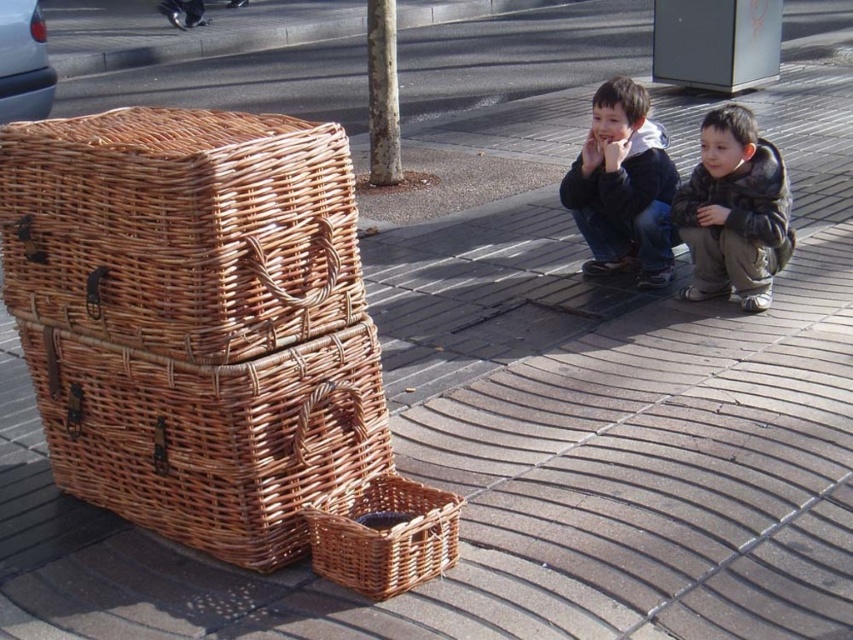
Does woven brown basket at left have a greater width compared to asphalt at upper center?

No, woven brown basket at left is not wider than asphalt at upper center.

Who is positioned more to the right, woven brown basket at left or asphalt at upper center?

From the viewer's perspective, woven brown basket at left appears more on the right side.

Identify the location of woven brown basket at left. (210, 435).

Is woven brown basket at lower left to the right of dark blue jacket at lower right from the viewer's perspective?

No, woven brown basket at lower left is not to the right of dark blue jacket at lower right.

Can you confirm if woven brown basket at lower left is positioned above dark blue jacket at lower right?

Actually, woven brown basket at lower left is below dark blue jacket at lower right.

Is point (109, 259) in front of point (631, 109)?

Yes, it is.

This screenshot has height=640, width=853. Find the location of `woven brown basket at lower left`. woven brown basket at lower left is located at coordinates click(x=180, y=228).

Consider the image. Can you confirm if woven brown basket at lower left is positioned below asphalt at upper center?

Indeed, woven brown basket at lower left is positioned under asphalt at upper center.

Which is below, woven brown basket at lower left or asphalt at upper center?

woven brown basket at lower left is below.

Is point (314, 163) in front of point (492, 10)?

Yes, point (314, 163) is in front of point (492, 10).

Where is `woven brown basket at lower left`? The width and height of the screenshot is (853, 640). woven brown basket at lower left is located at coordinates (180, 228).